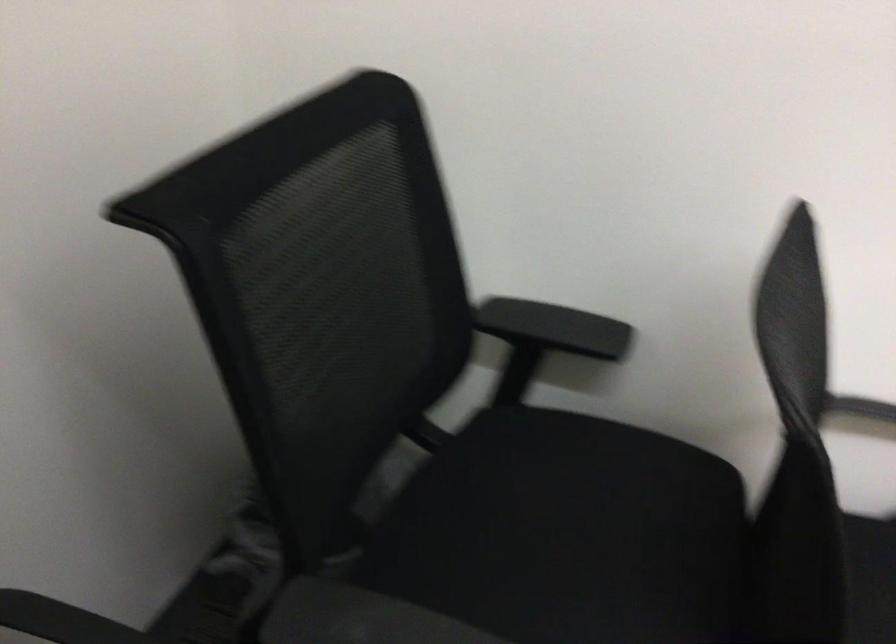
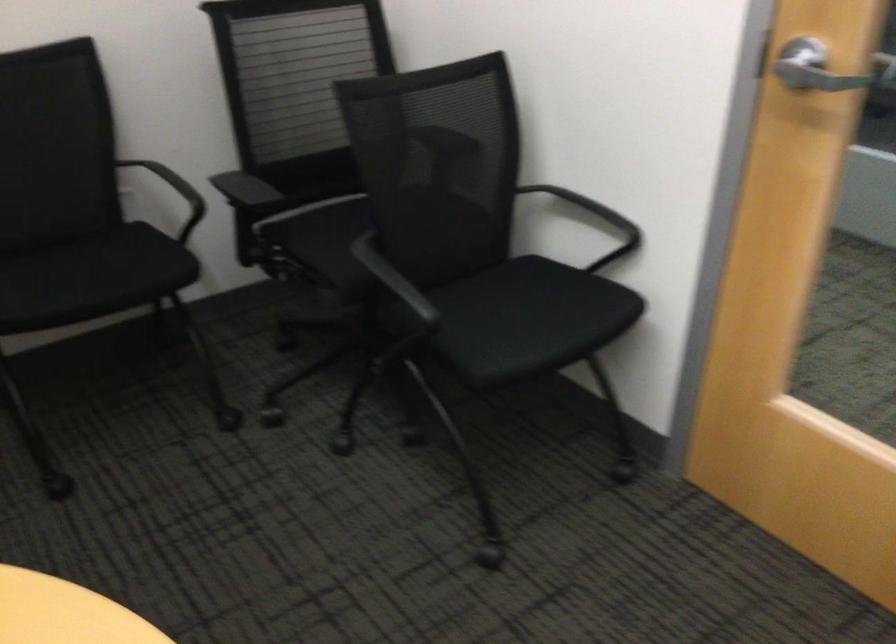
Question: I am providing you with two images of the same scene from different viewpoints. After the viewpoint changes to image2, which objects are now occluded?

Choices:
 (A) black chair armrest
 (B) chair sitting surface
 (C) orange trash bin
 (D) chair armrest

Answer: (A)